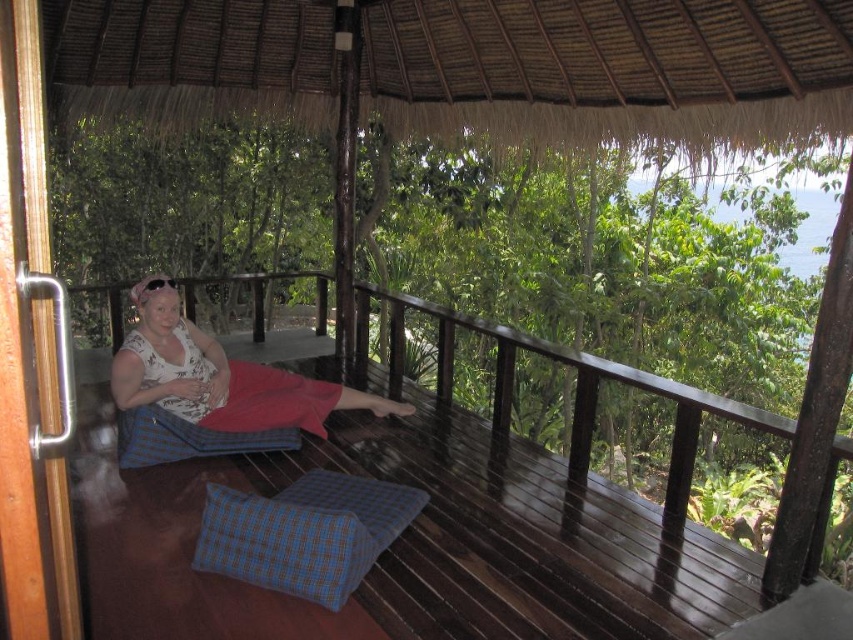
Question: Which object is closer to the camera taking this photo?

Choices:
 (A) thatched straw roof at upper center
 (B) blue checkered pillow at lower center
 (C) matte white blouse at center

Answer: (B)

Question: Which object is positioned farthest from the thatched straw roof at upper center?

Choices:
 (A) matte white blouse at center
 (B) blue checkered pillow at lower center

Answer: (B)

Question: Among these objects, which one is farthest from the camera?

Choices:
 (A) blue checkered pillow at lower center
 (B) matte white blouse at center

Answer: (B)

Question: Can you confirm if matte white blouse at center is positioned below blue checkered pillow at lower center?

Choices:
 (A) yes
 (B) no

Answer: (B)

Question: Can you confirm if thatched straw roof at upper center is smaller than matte white blouse at center?

Choices:
 (A) yes
 (B) no

Answer: (B)

Question: Is thatched straw roof at upper center to the left of matte white blouse at center from the viewer's perspective?

Choices:
 (A) yes
 (B) no

Answer: (B)